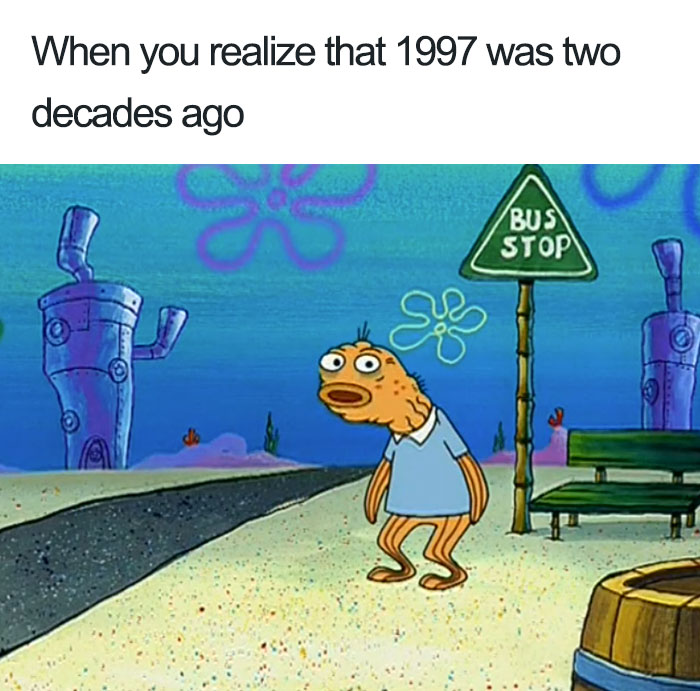
At what (x,y) coordinates should I click in order to perform the action: click on door frame. Please return your answer as a coordinate pair (x, y). Image resolution: width=700 pixels, height=691 pixels. Looking at the image, I should click on (83, 460).